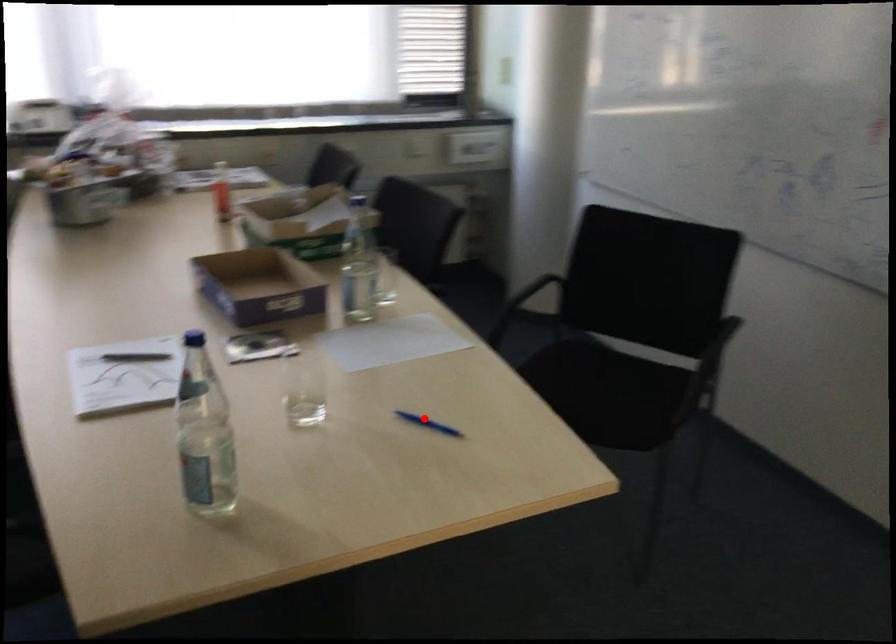
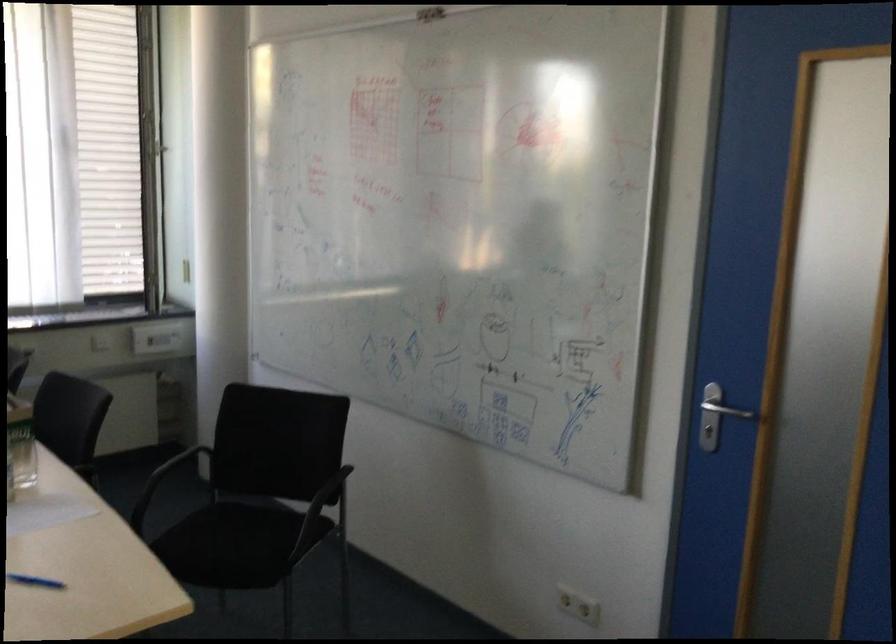
Locate, in the second image, the point that corresponds to the highlighted location in the first image.

(35, 581)